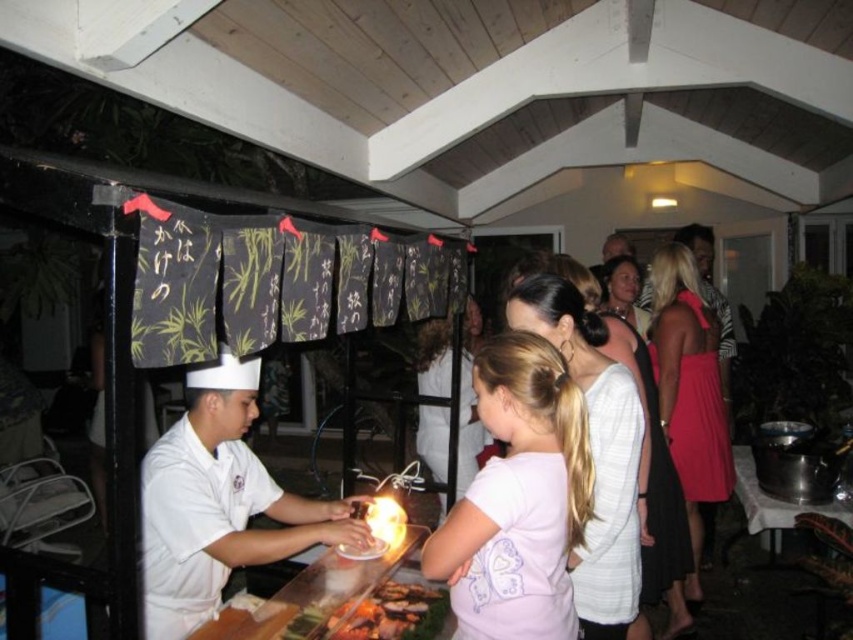
Which is in front, point (639, 445) or point (405, 612)?

Point (639, 445) is in front.

Which of these two, white matte dress at center or grilled meat at center, stands taller?

white matte dress at center is taller.

Does point (611, 490) lie behind point (403, 589)?

No, (611, 490) is in front of (403, 589).

Where is `white matte dress at center`? The image size is (853, 640). white matte dress at center is located at coordinates (595, 451).

Is light pink fabric at center smaller than white matte dress at center?

Correct, light pink fabric at center occupies less space than white matte dress at center.

Is light pink fabric at center below white matte dress at center?

Correct, light pink fabric at center is located below white matte dress at center.

Where is `light pink fabric at center`? Image resolution: width=853 pixels, height=640 pixels. light pink fabric at center is located at coordinates (518, 499).

Does light pink fabric dress at center have a larger size compared to grilled meat at center?

Yes.

This screenshot has width=853, height=640. What do you see at coordinates (468, 406) in the screenshot? I see `light pink fabric dress at center` at bounding box center [468, 406].

Does point (476, 468) lie in front of point (434, 612)?

That is False.

The height and width of the screenshot is (640, 853). What are the coordinates of `light pink fabric dress at center` in the screenshot? It's located at (468, 406).